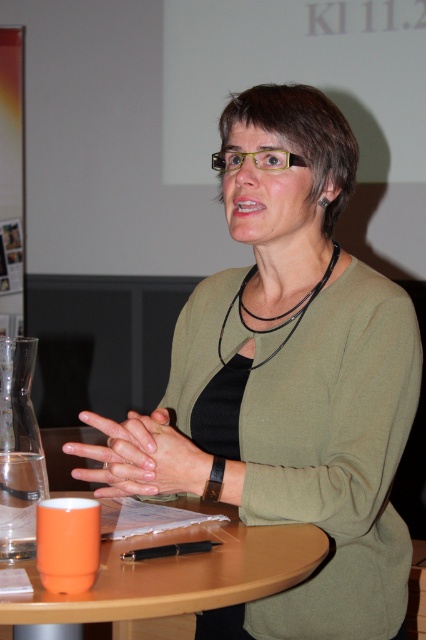
You are a barista preparing a drink for a customer. You have an orange matte cup at lower left and smooth skin hands at center. Which object is bigger?

The orange matte cup at lower left is larger in size than smooth skin hands at center.

You are a fashion designer who wants to place a new accessory exactly at the position of the matte green sweater at center. What are the coordinates where you should place it?

The coordinates for the position of the matte green sweater at center are 0.595 in the x axis and 0.674 in the y axis.